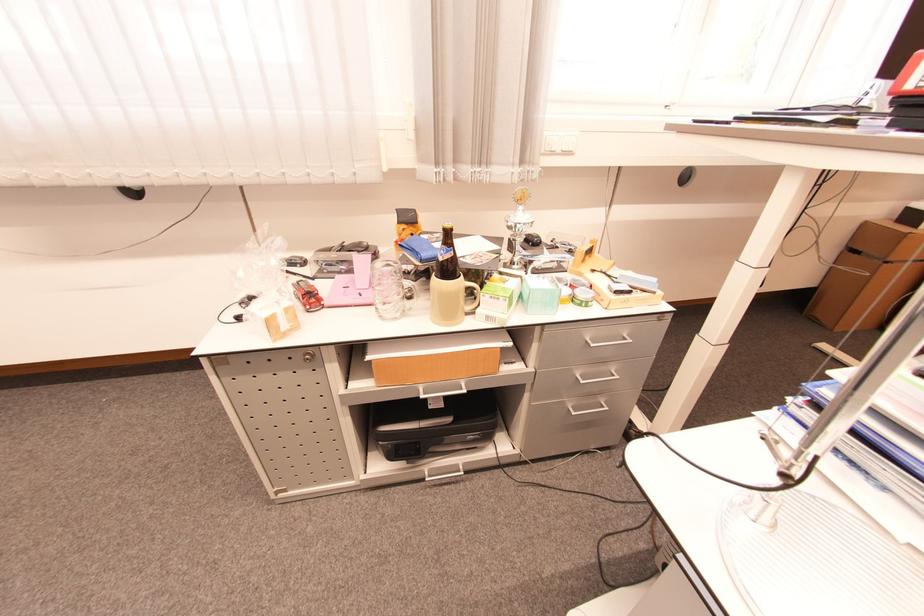
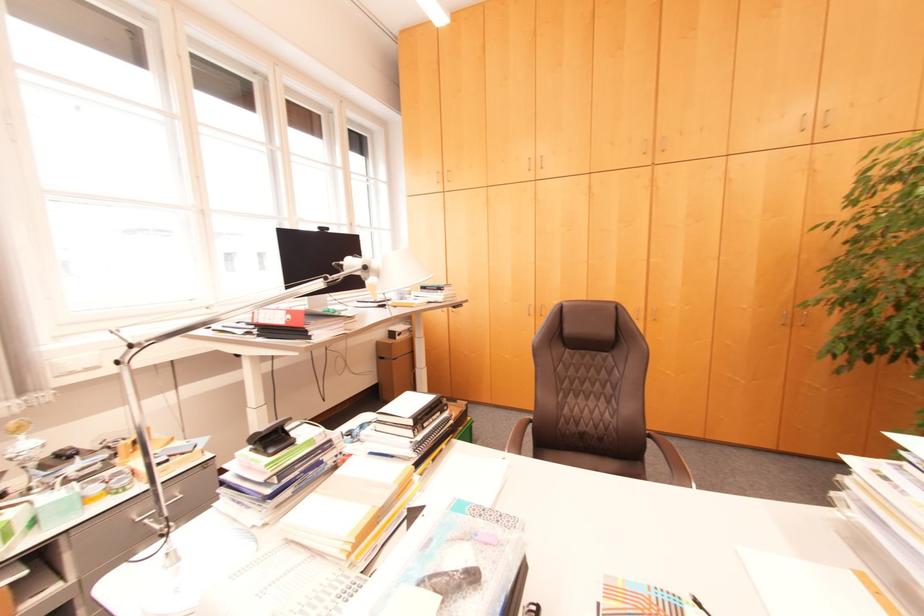
Question: The images are taken continuously from a first-person perspective. In which direction is your viewpoint rotating?

Choices:
 (A) Left
 (B) Right
 (C) Up
 (D) Down

Answer: (B)